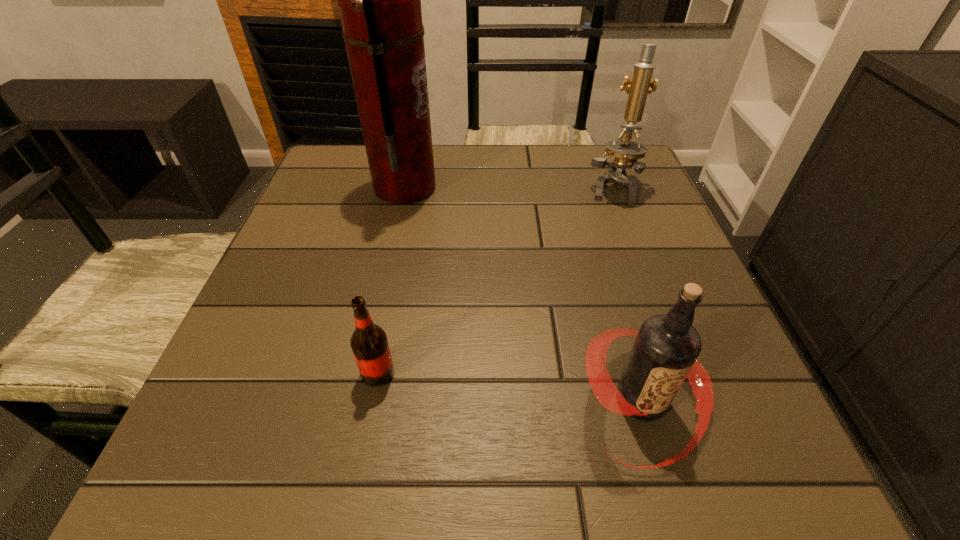
You are a GUI agent. You are given a task and a screenshot of the screen. Output one action in this format:
    pyautogui.click(x=<x>, y=<y>)
    Task: Click on the microscope at the far edge
    This screenshot has width=960, height=540.
    Given the screenshot: What is the action you would take?
    pyautogui.click(x=626, y=152)

You are a GUI agent. You are given a task and a screenshot of the screen. Output one action in this format:
    pyautogui.click(x=<x>, y=<y>)
    Task: Click on the object that is at the near edge
    This screenshot has height=540, width=960.
    Given the screenshot: What is the action you would take?
    pyautogui.click(x=666, y=348)

This screenshot has height=540, width=960. In order to click on object that is at the left edge in this screenshot , I will do `click(379, 0)`.

Where is `microscope that is at the right edge`? This screenshot has height=540, width=960. microscope that is at the right edge is located at coordinates (626, 152).

Identify the location of root beer located in the right edge section of the desktop. The width and height of the screenshot is (960, 540). (666, 348).

You are a GUI agent. You are given a task and a screenshot of the screen. Output one action in this format:
    pyautogui.click(x=<x>, y=<y>)
    Task: Click on the object located at the far left corner
    This screenshot has height=540, width=960.
    Given the screenshot: What is the action you would take?
    pyautogui.click(x=379, y=0)

You are a GUI agent. You are given a task and a screenshot of the screen. Output one action in this format:
    pyautogui.click(x=<x>, y=<y>)
    Task: Click on the object at the far right corner
    
    Given the screenshot: What is the action you would take?
    pyautogui.click(x=626, y=152)

Where is `object at the near right corner`? object at the near right corner is located at coordinates (666, 348).

Locate an element on the screen. The image size is (960, 540). vacant region at the far edge of the desktop is located at coordinates (469, 146).

In the image, there is a desktop. What are the coordinates of `vacant space at the near edge` in the screenshot? It's located at (564, 463).